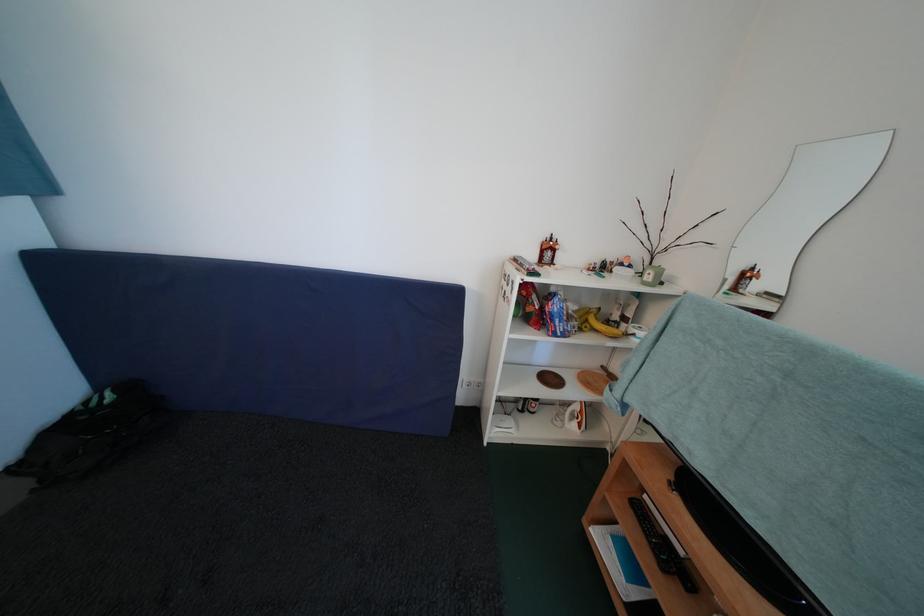
Find where to lift the blue snack bag. Please return your answer as a coordinate pair (x, y).

(555, 315)